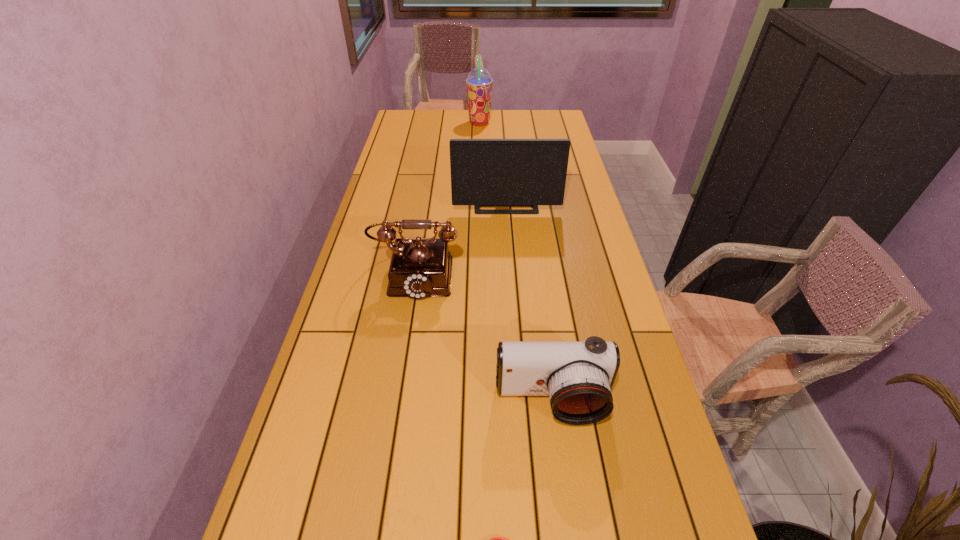
This screenshot has height=540, width=960. Find the location of `smoothie`. smoothie is located at coordinates (479, 82).

What are the coordinates of `the fourth nearest object` in the screenshot? It's located at (484, 172).

The height and width of the screenshot is (540, 960). What are the coordinates of `the third nearest object` in the screenshot? It's located at (420, 267).

I want to click on the third shortest object, so click(420, 267).

Where is `camcorder`? The height and width of the screenshot is (540, 960). camcorder is located at coordinates (578, 377).

Where is `the second shortest object`? the second shortest object is located at coordinates (578, 377).

Find the location of a particular element. The height and width of the screenshot is (540, 960). blank area located on the front of the farthest object is located at coordinates (x=479, y=168).

Where is `vacant position located 0.260m on the screen side of the computer monitor`? vacant position located 0.260m on the screen side of the computer monitor is located at coordinates (511, 265).

At what (x,y) coordinates should I click in order to perform the action: click on free region located on the dial of the third farthest object. Please return your answer as a coordinate pair (x, y). Looking at the image, I should click on (395, 404).

This screenshot has width=960, height=540. Find the location of `vacant space located 0.090m on the surface of the camcorder`. vacant space located 0.090m on the surface of the camcorder is located at coordinates (562, 471).